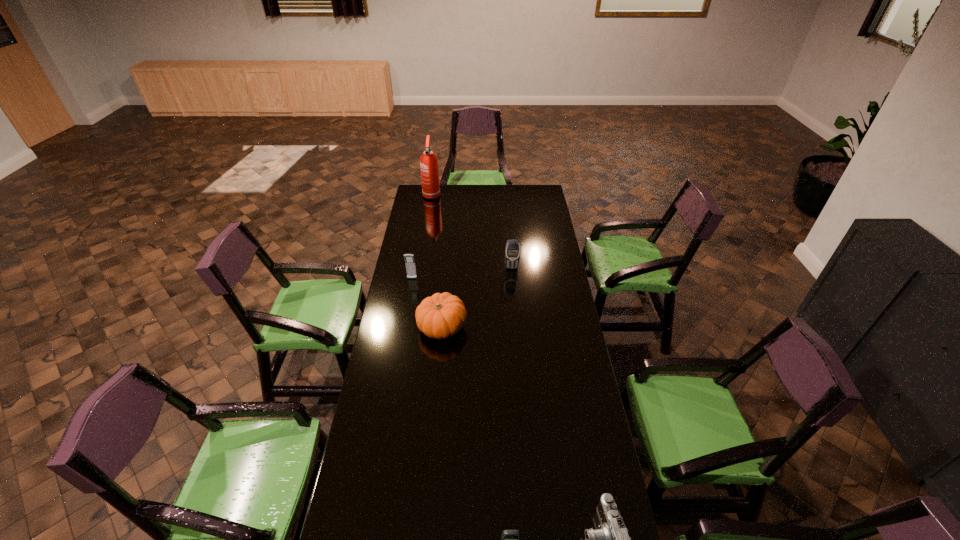
Find the location of `fire extinguisher`. fire extinguisher is located at coordinates (428, 161).

The image size is (960, 540). In order to click on the farthest object in this screenshot , I will do `click(428, 161)`.

Image resolution: width=960 pixels, height=540 pixels. I want to click on the rightmost cellular telephone, so click(512, 251).

Identify the location of the farthest cellular telephone. (512, 251).

Where is `the fourth nearest object`? The width and height of the screenshot is (960, 540). the fourth nearest object is located at coordinates (409, 258).

Image resolution: width=960 pixels, height=540 pixels. Identify the location of the leftmost cellular telephone. (409, 258).

In order to click on the fourth farthest object in this screenshot , I will do `click(440, 316)`.

You are a GUI agent. You are given a task and a screenshot of the screen. Output one action in this format:
    pyautogui.click(x=<x>, y=<y>)
    Task: Click on the free space located at the nozzle of the tallest object
    The height and width of the screenshot is (540, 960).
    Given the screenshot: What is the action you would take?
    pyautogui.click(x=428, y=219)

Identify the location of vacant space located 0.340m on the front face of the farthest cellular telephone. (516, 318).

The height and width of the screenshot is (540, 960). I want to click on vacant space situated 0.350m on the front-facing side of the second farthest cellular telephone, so click(x=402, y=332).